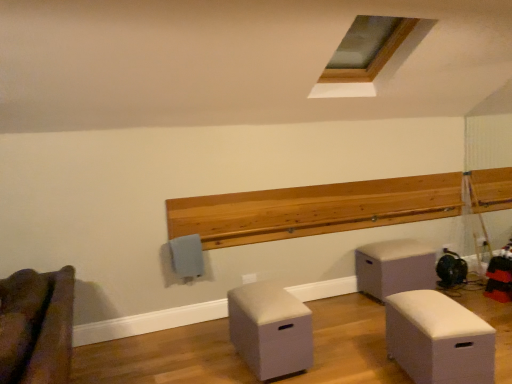
Question: Is matte gray ottoman at center right, which is the first furniture from right to left, positioned beyond the bounds of clear glass window at upper center?

Choices:
 (A) yes
 (B) no

Answer: (A)

Question: Does matte gray ottoman at center right, the 4th furniture positioned from the left, have a lesser height compared to clear glass window at upper center?

Choices:
 (A) yes
 (B) no

Answer: (A)

Question: Is matte gray ottoman at center right, which is the first furniture from right to left, thinner than clear glass window at upper center?

Choices:
 (A) no
 (B) yes

Answer: (B)

Question: Is the position of matte gray ottoman at center right, which is the first furniture from right to left, more distant than that of clear glass window at upper center?

Choices:
 (A) yes
 (B) no

Answer: (A)

Question: From a real-world perspective, is matte gray ottoman at center right, the 4th furniture positioned from the left, physically above clear glass window at upper center?

Choices:
 (A) yes
 (B) no

Answer: (B)

Question: Considering the positions of matte gray ottoman at center right, which is the first furniture from right to left, and beige fabric ottoman at center, which ranks as the third furniture in right-to-left order, in the image, is matte gray ottoman at center right, which is the first furniture from right to left, bigger or smaller than beige fabric ottoman at center, which ranks as the third furniture in right-to-left order,?

Choices:
 (A) big
 (B) small

Answer: (A)

Question: Choose the correct answer: Is matte gray ottoman at center right, which is the first furniture from right to left, inside beige fabric ottoman at center, which is the 2th furniture from left to right, or outside it?

Choices:
 (A) outside
 (B) inside

Answer: (A)

Question: From the image's perspective, is matte gray ottoman at center right, the 4th furniture positioned from the left, positioned above or below beige fabric ottoman at center, which is the 2th furniture from left to right?

Choices:
 (A) below
 (B) above

Answer: (B)

Question: Is matte gray ottoman at center right, which is the first furniture from right to left, in front of or behind beige fabric ottoman at center, which ranks as the third furniture in right-to-left order, in the image?

Choices:
 (A) behind
 (B) front

Answer: (A)

Question: Looking at the image, does wooden ledge at upper center seem bigger or smaller compared to brown fabric couch at lower left, which appears as the 4th furniture when viewed from the right?

Choices:
 (A) small
 (B) big

Answer: (A)

Question: Is point (377, 195) positioned closer to the camera than point (50, 352)?

Choices:
 (A) farther
 (B) closer

Answer: (A)

Question: Is wooden ledge at upper center inside the boundaries of brown fabric couch at lower left, the first furniture when ordered from left to right, or outside?

Choices:
 (A) inside
 (B) outside

Answer: (B)

Question: From the image's perspective, is wooden ledge at upper center located above or below brown fabric couch at lower left, which appears as the 4th furniture when viewed from the right?

Choices:
 (A) above
 (B) below

Answer: (A)

Question: Visually, is brown fabric couch at lower left, which appears as the 4th furniture when viewed from the right, positioned to the left or to the right of beige fabric ottoman at center, which ranks as the third furniture in right-to-left order?

Choices:
 (A) left
 (B) right

Answer: (A)

Question: Is brown fabric couch at lower left, the first furniture when ordered from left to right, spatially inside beige fabric ottoman at center, which ranks as the third furniture in right-to-left order, or outside of it?

Choices:
 (A) outside
 (B) inside

Answer: (A)